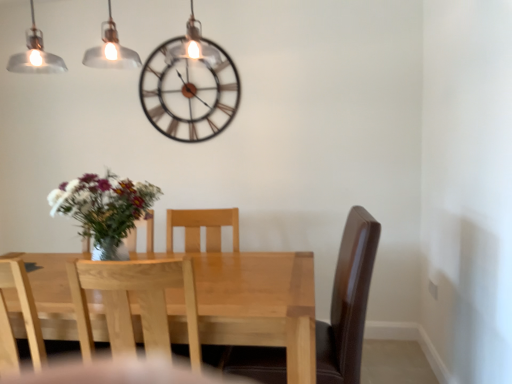
Question: From a real-world perspective, is light wood table at center beneath light wood chair at center, the first chair when ordered from right to left?

Choices:
 (A) no
 (B) yes

Answer: (B)

Question: Can we say light wood table at center lies outside light wood chair at center, the first chair when ordered from right to left?

Choices:
 (A) no
 (B) yes

Answer: (B)

Question: Can you confirm if light wood table at center is wider than light wood chair at center, the second chair positioned from the left?

Choices:
 (A) yes
 (B) no

Answer: (A)

Question: Can light wood chair at center, the first chair when ordered from right to left, be found inside light wood table at center?

Choices:
 (A) yes
 (B) no

Answer: (A)

Question: Is light wood chair at center, the second chair positioned from the left, at the back of light wood table at center?

Choices:
 (A) yes
 (B) no

Answer: (B)

Question: From a real-world perspective, is light wood table at center on top of light wood chair at center, the first chair when ordered from right to left?

Choices:
 (A) no
 (B) yes

Answer: (A)

Question: Does metallic brown clock at upper center have a greater height compared to light wood chair at left, the 2th chair positioned from the right?

Choices:
 (A) no
 (B) yes

Answer: (A)

Question: Considering the relative sizes of metallic brown clock at upper center and light wood chair at left, the 2th chair positioned from the right, in the image provided, is metallic brown clock at upper center wider than light wood chair at left, the 2th chair positioned from the right,?

Choices:
 (A) yes
 (B) no

Answer: (B)

Question: From a real-world perspective, is metallic brown clock at upper center located higher than light wood chair at left, acting as the 1th chair starting from the left?

Choices:
 (A) no
 (B) yes

Answer: (B)

Question: Is metallic brown clock at upper center positioned before light wood chair at left, the 2th chair positioned from the right?

Choices:
 (A) no
 (B) yes

Answer: (A)

Question: Considering the relative sizes of metallic brown clock at upper center and light wood chair at left, the 2th chair positioned from the right, in the image provided, is metallic brown clock at upper center bigger than light wood chair at left, the 2th chair positioned from the right,?

Choices:
 (A) yes
 (B) no

Answer: (B)

Question: From the image's perspective, is metallic brown clock at upper center beneath light wood chair at left, acting as the 1th chair starting from the left?

Choices:
 (A) no
 (B) yes

Answer: (A)

Question: Are light wood chair at left, acting as the 1th chair starting from the left, and light wood table at center making contact?

Choices:
 (A) no
 (B) yes

Answer: (A)